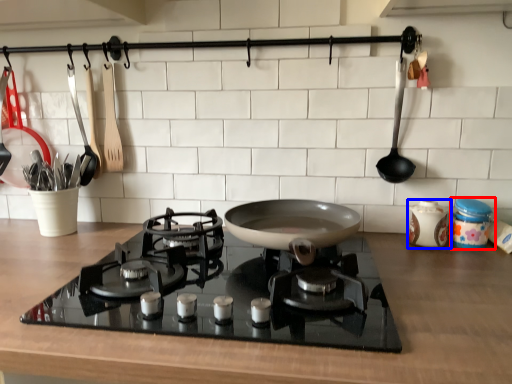
Question: Which of the following is the farthest to the observer, kitchen appliance (highlighted by a red box) or kitchen appliance (highlighted by a blue box)?

Choices:
 (A) kitchen appliance
 (B) kitchen appliance

Answer: (B)